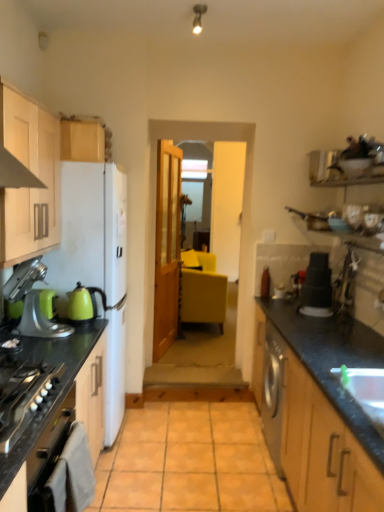
Where is `vacant space underneath clear glass door at center (from a real-world perspective)`? Image resolution: width=384 pixels, height=512 pixels. vacant space underneath clear glass door at center (from a real-world perspective) is located at coordinates (191, 367).